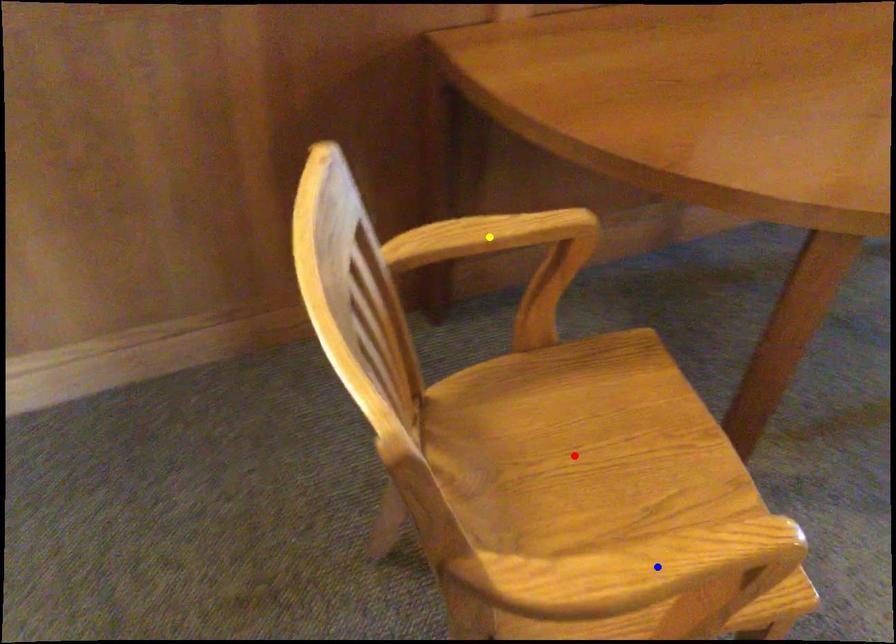
Order these from farthest to nearest:
red point, blue point, yellow point

red point
yellow point
blue point